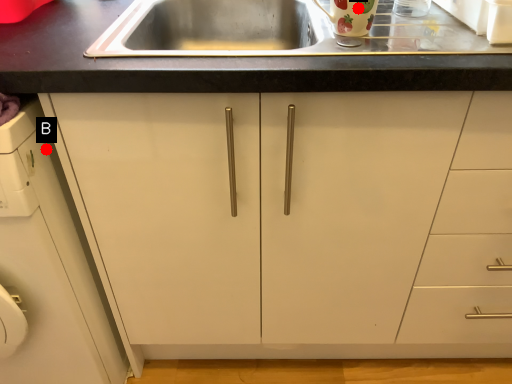
Question: Two points are circled on the image, labeled by A and B beside each circle. Which of the following is the farthest from the observer?

Choices:
 (A) A is further
 (B) B is further

Answer: (B)